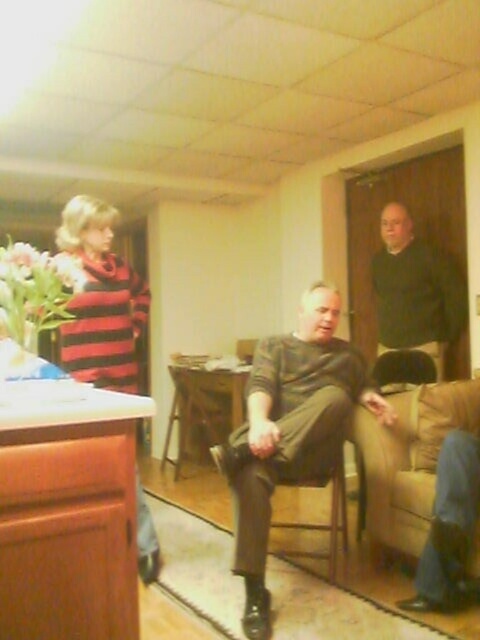
You are a delivery person who needs to place a package between the striped sweater at left and the dark green sweater at upper right. The package requires a minimum of 2 meters of space. Can you fit it there?

The distance between the striped sweater at left and the dark green sweater at upper right is 1.96 meters, which is slightly less than the required 2 meters. Therefore, the package cannot be placed there as it does not meet the minimum space requirement.

You are trying to decide which striped sweater to take for a casual outing. Both the striped sweater at center and the striped sweater at left are available. Based on their sizes, which one would you choose if you want a larger sweater?

The striped sweater at center is much taller than the striped sweater at left, so you should choose the striped sweater at center for a larger size.

Based on the scene description, where is the beige fabric couch at lower right located in terms of its 2D coordinates?

The beige fabric couch at lower right is located at the 2D coordinates of point (x=408, y=460).